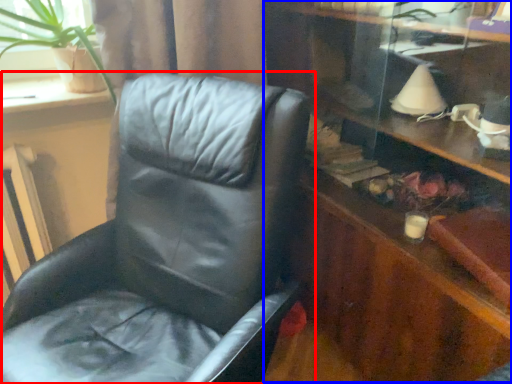
Question: Which object appears farthest to the camera in this image, chair (highlighted by a red box) or dresser (highlighted by a blue box)?

Choices:
 (A) chair
 (B) dresser

Answer: (B)